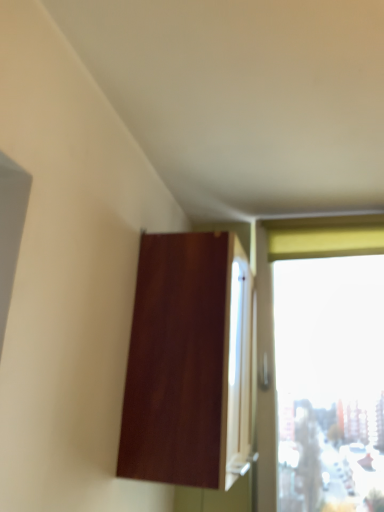
The height and width of the screenshot is (512, 384). What do you see at coordinates (190, 362) in the screenshot? I see `dark wood cabinet at center` at bounding box center [190, 362].

Find the location of a particular element. dark wood cabinet at center is located at coordinates (190, 362).

Where is `dark wood cabinet at center`? The width and height of the screenshot is (384, 512). dark wood cabinet at center is located at coordinates (190, 362).